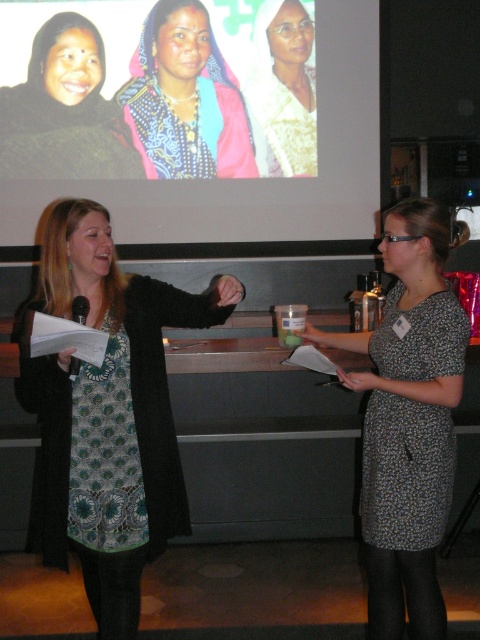
Question: Can you confirm if blue and white patterned scarf at center is positioned to the right of white textured scarf at upper center?

Choices:
 (A) no
 (B) yes

Answer: (A)

Question: Among these objects, which one is farthest from the camera?

Choices:
 (A) white textured scarf at upper center
 (B) patterned fabric dress at center
 (C) blue and white patterned scarf at center
 (D) printed fabric dress at center

Answer: (A)

Question: Considering the real-world distances, which object is closest to the matte black dress at upper left?

Choices:
 (A) patterned fabric dress at center
 (B) printed fabric dress at center
 (C) white textured scarf at upper center

Answer: (C)

Question: Where is patterned fabric dress at center located in relation to white textured scarf at upper center in the image?

Choices:
 (A) left
 (B) right

Answer: (A)

Question: Among these points, which one is farthest from the camera?

Choices:
 (A) (105, 212)
 (B) (204, 58)
 (C) (268, 113)
 (D) (408, 198)

Answer: (C)

Question: Does printed fabric dress at center have a smaller size compared to white textured scarf at upper center?

Choices:
 (A) no
 (B) yes

Answer: (A)